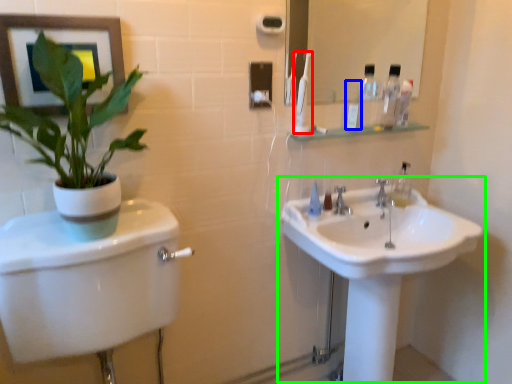
Question: Estimate the real-world distances between objects in this image. Which object is closer to toothbrush (highlighted by a red box), toiletry (highlighted by a blue box) or sink (highlighted by a green box)?

Choices:
 (A) toiletry
 (B) sink

Answer: (A)